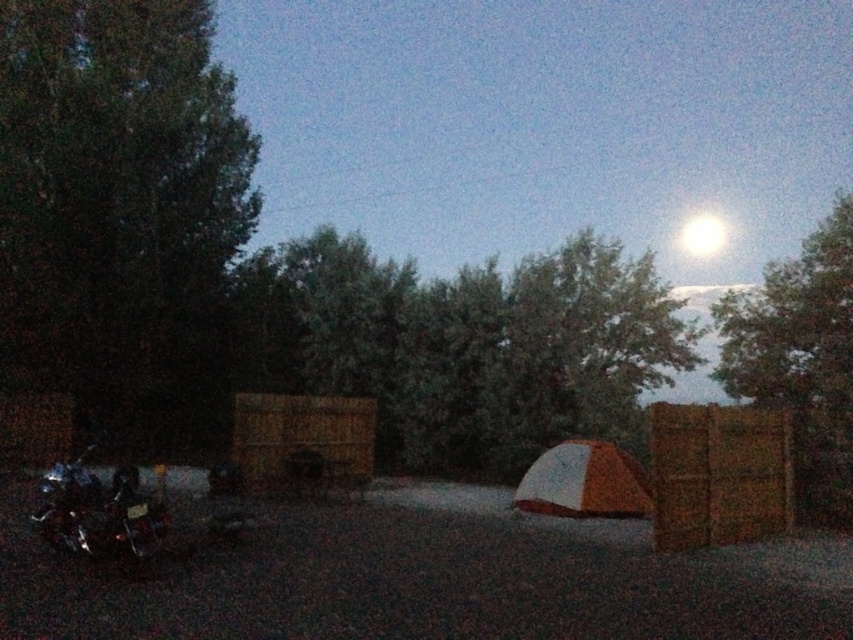
Is green leafy tree at left smaller than bright white orb at upper center?

No.

Is green leafy tree at left shorter than bright white orb at upper center?

In fact, green leafy tree at left may be taller than bright white orb at upper center.

Between point (99, 362) and point (722, 243), which one is positioned in front?

Point (99, 362) is in front.

Find the location of a particular element. This screenshot has width=853, height=640. green leafy tree at left is located at coordinates coord(115,198).

From the picture: Between green leafy tree at left and shiny chrome motorcycle at lower left, which one is positioned lower?

shiny chrome motorcycle at lower left is below.

Is point (258, 205) positioned before point (131, 490)?

No, (258, 205) is further to viewer.

Where is `green leafy tree at left`? Image resolution: width=853 pixels, height=640 pixels. green leafy tree at left is located at coordinates (115, 198).

Between brown woven crate at right and wooden crate at center, which one is positioned higher?

wooden crate at center

Between brown woven crate at right and wooden crate at center, which one has less height?

wooden crate at center is shorter.

This screenshot has width=853, height=640. Find the location of `brown woven crate at right`. brown woven crate at right is located at coordinates (718, 474).